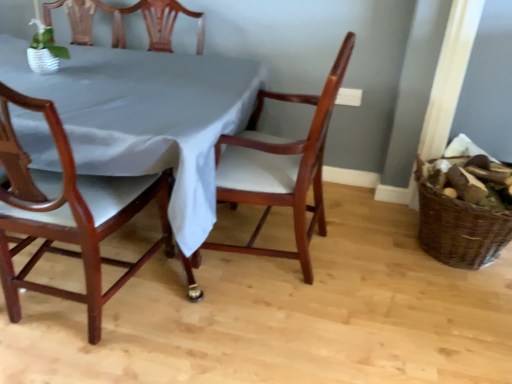
Question: Is mahogany wood chair at left, positioned as the first chair in left-to-right order, further to camera compared to satin white tablecloth at center?

Choices:
 (A) yes
 (B) no

Answer: (B)

Question: Is mahogany wood chair at left, the second chair in the right-to-left sequence, facing away from satin white tablecloth at center?

Choices:
 (A) yes
 (B) no

Answer: (A)

Question: From a real-world perspective, is mahogany wood chair at left, the second chair in the right-to-left sequence, beneath satin white tablecloth at center?

Choices:
 (A) yes
 (B) no

Answer: (B)

Question: Can you confirm if mahogany wood chair at left, the second chair in the right-to-left sequence, is wider than satin white tablecloth at center?

Choices:
 (A) no
 (B) yes

Answer: (A)

Question: Is mahogany wood chair at left, the second chair in the right-to-left sequence, completely or partially outside of satin white tablecloth at center?

Choices:
 (A) yes
 (B) no

Answer: (B)

Question: From the image's perspective, is mahogany wood chair at left, the second chair in the right-to-left sequence, above or below mahogany wood chair at center, the 1th chair in the right-to-left sequence?

Choices:
 (A) above
 (B) below

Answer: (B)

Question: In terms of height, does mahogany wood chair at left, positioned as the first chair in left-to-right order, look taller or shorter compared to mahogany wood chair at center, the 1th chair in the right-to-left sequence?

Choices:
 (A) tall
 (B) short

Answer: (A)

Question: Considering their positions, is mahogany wood chair at left, positioned as the first chair in left-to-right order, located in front of or behind mahogany wood chair at center, the second chair when ordered from left to right?

Choices:
 (A) behind
 (B) front

Answer: (B)

Question: Is point (25, 183) positioned closer to the camera than point (296, 175)?

Choices:
 (A) farther
 (B) closer

Answer: (B)

Question: Choose the correct answer: Is satin white tablecloth at center inside mahogany wood chair at left, positioned as the first chair in left-to-right order, or outside it?

Choices:
 (A) inside
 (B) outside

Answer: (B)

Question: Considering the positions of satin white tablecloth at center and mahogany wood chair at left, positioned as the first chair in left-to-right order, in the image, is satin white tablecloth at center bigger or smaller than mahogany wood chair at left, positioned as the first chair in left-to-right order,?

Choices:
 (A) big
 (B) small

Answer: (A)

Question: From a real-world perspective, relative to mahogany wood chair at left, the second chair in the right-to-left sequence, is satin white tablecloth at center vertically above or below?

Choices:
 (A) above
 (B) below

Answer: (B)

Question: Is satin white tablecloth at center taller or shorter than mahogany wood chair at left, the second chair in the right-to-left sequence?

Choices:
 (A) short
 (B) tall

Answer: (A)

Question: From a real-world perspective, is mahogany wood chair at center, the second chair when ordered from left to right, positioned above or below satin white tablecloth at center?

Choices:
 (A) below
 (B) above

Answer: (B)

Question: Which is correct: mahogany wood chair at center, the 1th chair in the right-to-left sequence, is inside satin white tablecloth at center, or outside of it?

Choices:
 (A) inside
 (B) outside

Answer: (A)